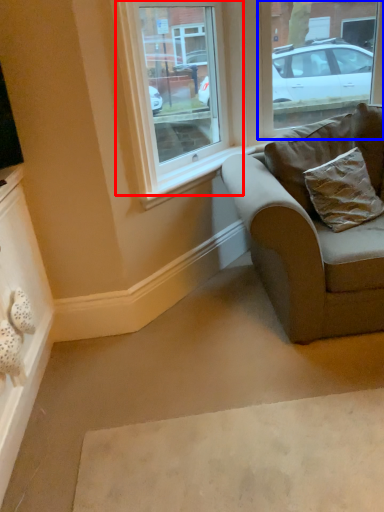
Question: Which of the following is the farthest to the observer, window (highlighted by a red box) or window (highlighted by a blue box)?

Choices:
 (A) window
 (B) window

Answer: (B)